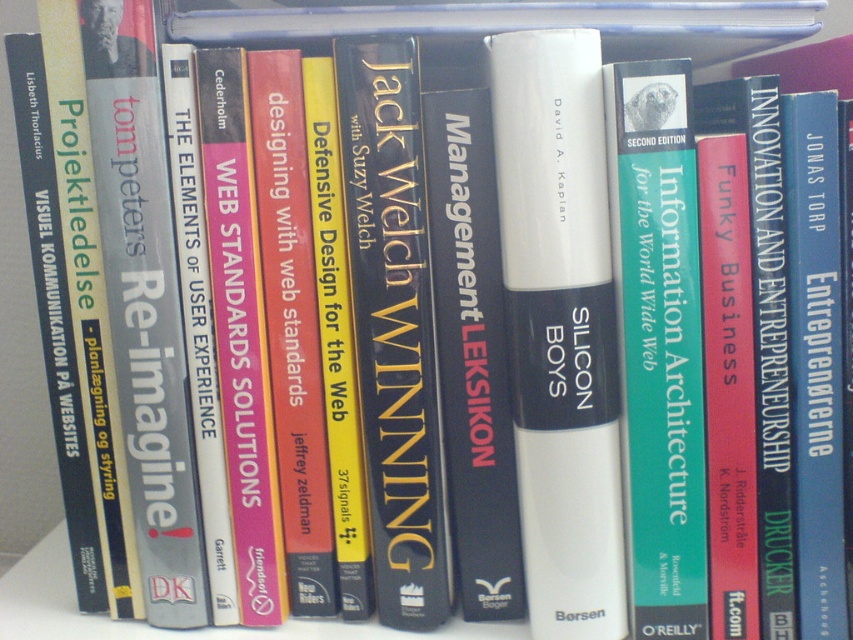
Who is more forward, (625, 141) or (407, 417)?

Point (625, 141) is more forward.

Who is shorter, green matte book at center or hardcover book at center?

green matte book at center

Who is more forward, (688, 531) or (367, 140)?

Point (367, 140) is more forward.

Identify the location of green matte book at center. (659, 342).

Is the position of white matte book at center less distant than that of hardcover book at center?

Yes, white matte book at center is closer to the viewer.

Which is below, white matte book at center or hardcover book at center?

white matte book at center

The width and height of the screenshot is (853, 640). What do you see at coordinates (560, 326) in the screenshot?
I see `white matte book at center` at bounding box center [560, 326].

Identify the location of white matte book at center. (560, 326).

Does white matte book at center have a smaller size compared to green matte book at center?

No.

How distant is white matte book at center from green matte book at center?

1.10 inches

Find the location of a particular element. This screenshot has height=640, width=853. white matte book at center is located at coordinates (560, 326).

Where is `white matte book at center`? The height and width of the screenshot is (640, 853). white matte book at center is located at coordinates (560, 326).